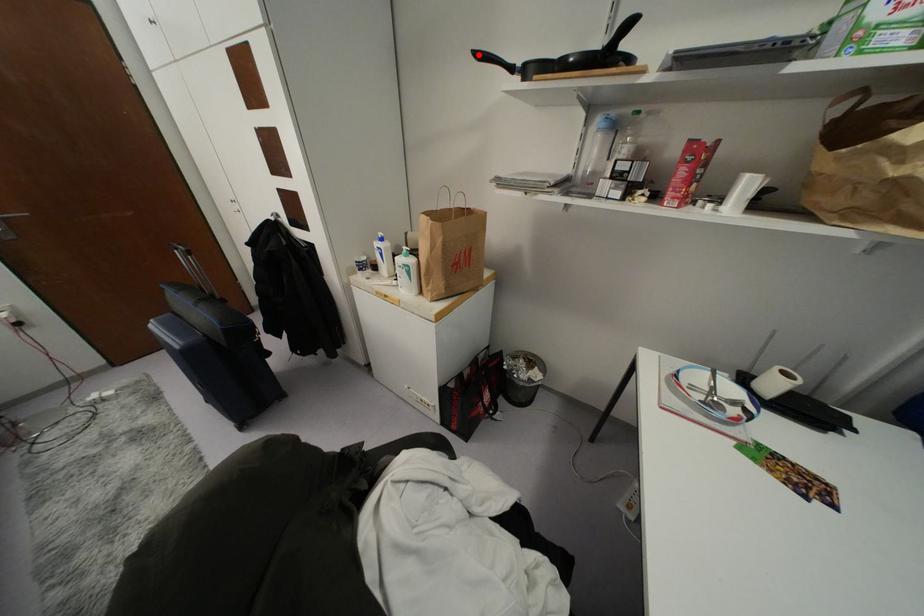
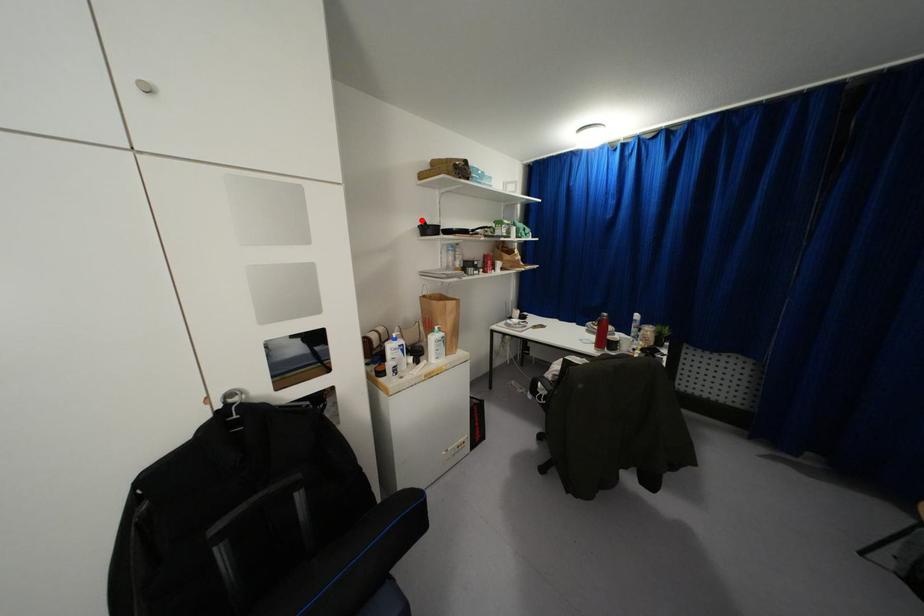
I am providing you with two images of the same scene from different viewpoints. A red point is marked on the first image and another point is marked on the second image. Does the point marked in image1 correspond to the same location as the one in image2?

Yes